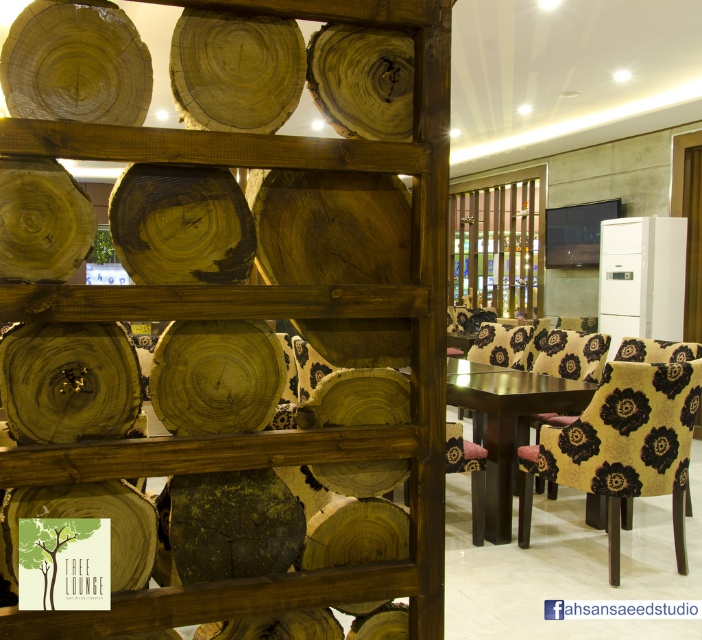
You are planning to seat guests at the dining table. You have two yellow floral fabric chairs available. The yellow floral fabric chair at right and the yellow floral fabric chair at center. Which chair should you choose if you want to accommodate more guests comfortably?

The yellow floral fabric chair at right is larger in size compared to the yellow floral fabric chair at center, so choosing the yellow floral fabric chair at right would allow for more comfortable seating for guests.

You are planning to seat guests at the dining table. You have two yellow floral fabric chairs available. The yellow floral fabric chair at right and the yellow floral fabric chair at center. Which chair should you choose if you need more space for each guest?

You should choose the yellow floral fabric chair at right because its width is larger than the yellow floral fabric chair at center, providing more space for each guest.